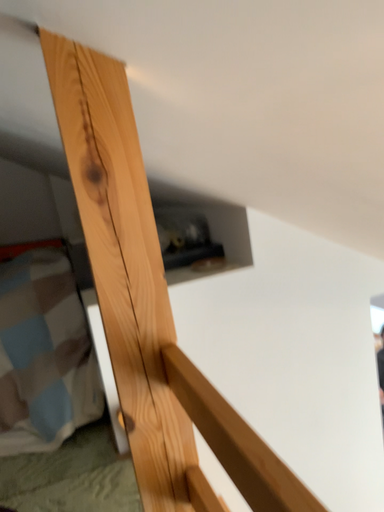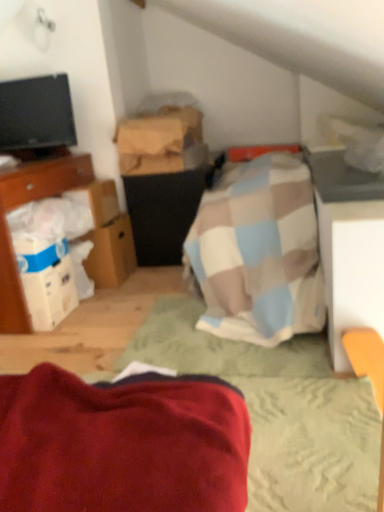
Question: Which way did the camera rotate in the video?

Choices:
 (A) rotated upward
 (B) rotated downward

Answer: (B)